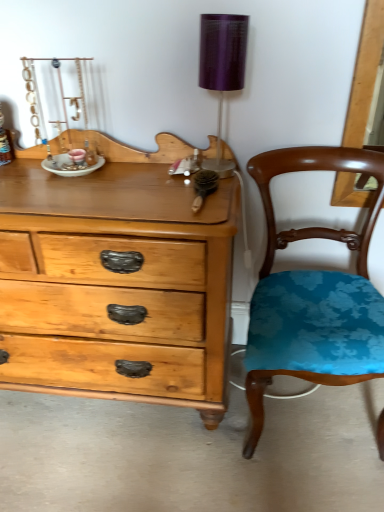
Question: Is purple fabric lampshade at upper right shorter than teal fabric chair at right?

Choices:
 (A) yes
 (B) no

Answer: (A)

Question: Can you confirm if purple fabric lampshade at upper right is wider than teal fabric chair at right?

Choices:
 (A) yes
 (B) no

Answer: (B)

Question: Is purple fabric lampshade at upper right smaller than teal fabric chair at right?

Choices:
 (A) yes
 (B) no

Answer: (A)

Question: Would you say purple fabric lampshade at upper right is outside teal fabric chair at right?

Choices:
 (A) yes
 (B) no

Answer: (A)

Question: Is purple fabric lampshade at upper right closer to camera compared to teal fabric chair at right?

Choices:
 (A) yes
 (B) no

Answer: (B)

Question: Is purple fabric lampshade at upper right placed right next to teal fabric chair at right?

Choices:
 (A) no
 (B) yes

Answer: (A)

Question: Is teal fabric chair at right shorter than purple fabric lampshade at upper right?

Choices:
 (A) no
 (B) yes

Answer: (A)

Question: Is teal fabric chair at right beside purple fabric lampshade at upper right?

Choices:
 (A) no
 (B) yes

Answer: (A)

Question: From the image's perspective, is teal fabric chair at right under purple fabric lampshade at upper right?

Choices:
 (A) no
 (B) yes

Answer: (B)

Question: Does teal fabric chair at right have a greater width compared to purple fabric lampshade at upper right?

Choices:
 (A) no
 (B) yes

Answer: (B)

Question: Could you tell me if teal fabric chair at right is facing purple fabric lampshade at upper right?

Choices:
 (A) no
 (B) yes

Answer: (A)

Question: From a real-world perspective, is teal fabric chair at right positioned under purple fabric lampshade at upper right based on gravity?

Choices:
 (A) no
 (B) yes

Answer: (B)

Question: Is teal fabric chair at right to the left or to the right of purple fabric lampshade at upper right in the image?

Choices:
 (A) left
 (B) right

Answer: (B)